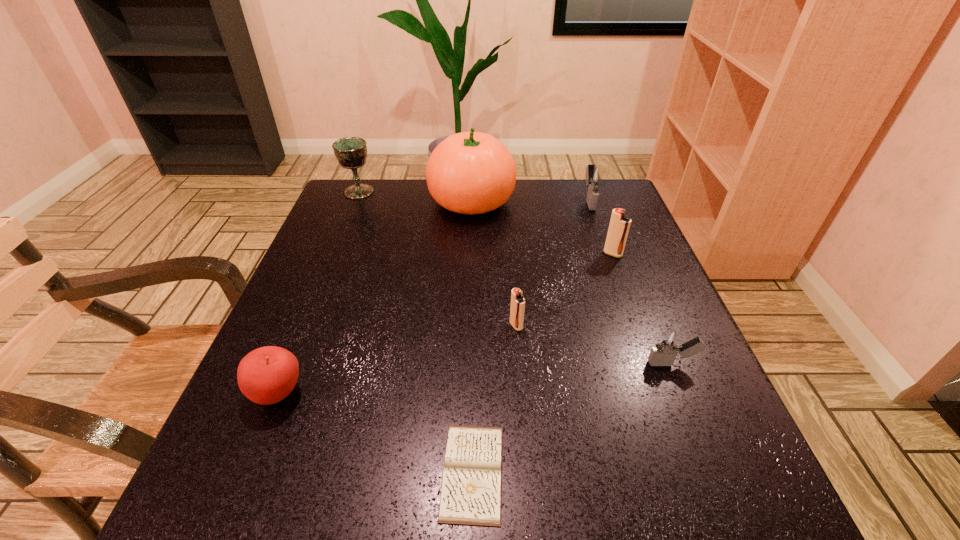
Locate an element on the screen. This screenshot has width=960, height=540. pumpkin is located at coordinates (471, 172).

In order to click on the second tallest object in this screenshot , I will do `click(351, 152)`.

This screenshot has width=960, height=540. Identify the location of the farthest igniter. (596, 176).

Locate an element on the screen. the farther gray igniter is located at coordinates (596, 176).

This screenshot has width=960, height=540. I want to click on the farther red igniter, so click(x=619, y=226).

What are the coordinates of `the third nearest igniter` in the screenshot? It's located at (619, 226).

Where is `red apple`? red apple is located at coordinates (266, 375).

Locate an element on the screen. The height and width of the screenshot is (540, 960). the fourth nearest object is located at coordinates pos(517,309).

This screenshot has height=540, width=960. In order to click on the left red igniter in this screenshot , I will do `click(517, 309)`.

This screenshot has height=540, width=960. Find the location of `the nearer gray igniter`. the nearer gray igniter is located at coordinates pos(667,346).